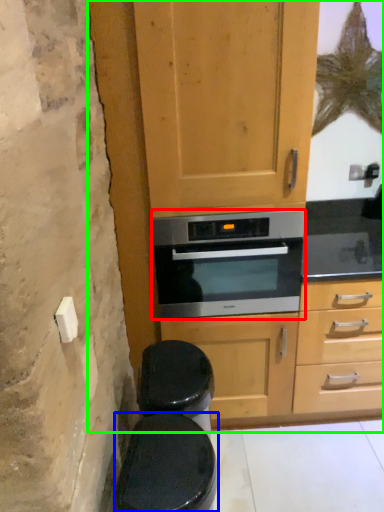
Question: Based on their relative distances, which object is farther from oven (highlighted by a red box)? Choose from toilet bowl (highlighted by a blue box) and dresser (highlighted by a green box).

Choices:
 (A) toilet bowl
 (B) dresser

Answer: (A)